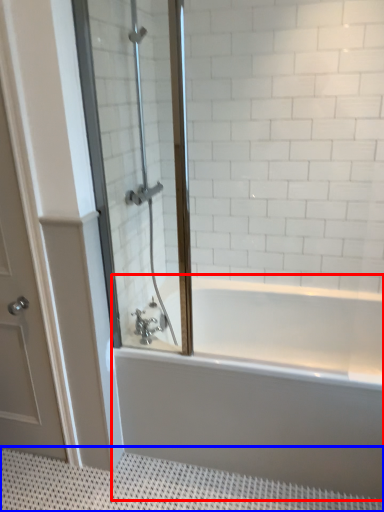
Question: Which point is closer to the camera, bathtub (highlighted by a red box) or bath mat (highlighted by a blue box)?

Choices:
 (A) bathtub
 (B) bath mat

Answer: (B)